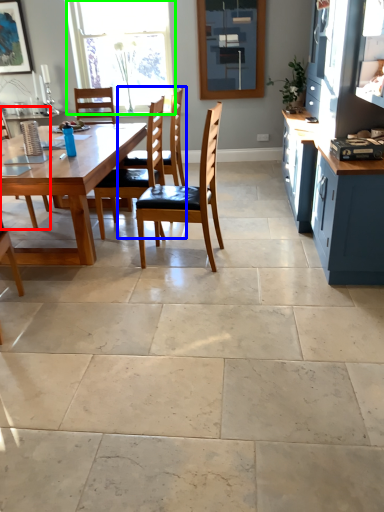
Question: Which object is the farthest from chair (highlighted by a red box)? Choose among these: chair (highlighted by a blue box) or window (highlighted by a green box).

Choices:
 (A) chair
 (B) window

Answer: (B)